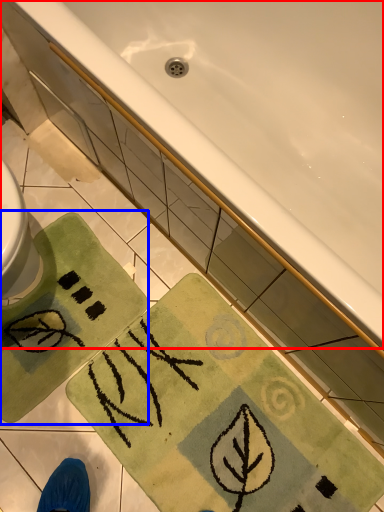
Question: Among these objects, which one is nearest to the camera, bathtub (highlighted by a red box) or beach towel (highlighted by a blue box)?

Choices:
 (A) bathtub
 (B) beach towel

Answer: (A)